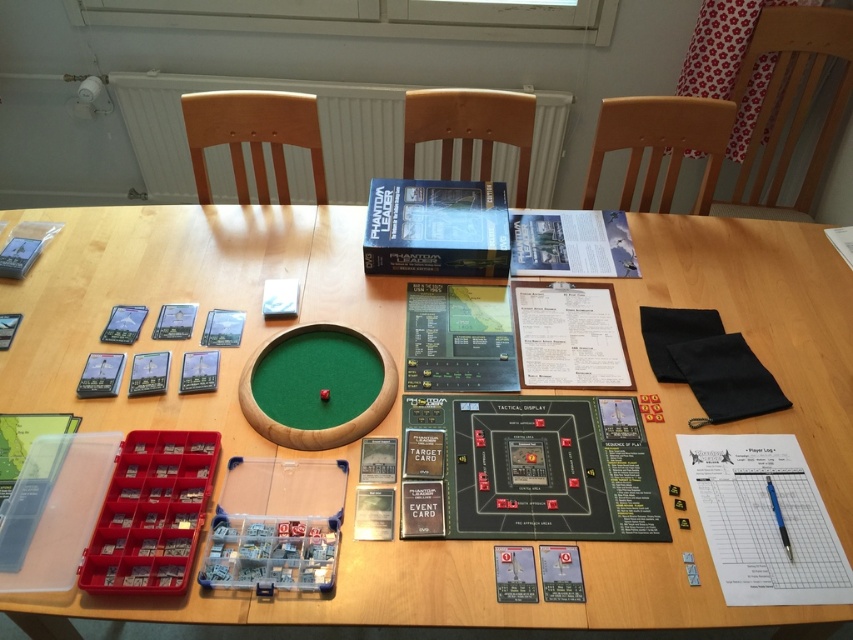
Question: Which object is farther from the camera taking this photo?

Choices:
 (A) green felt circle at center
 (B) blue plastic pen at center-right

Answer: (B)

Question: Which object appears closest to the camera in this image?

Choices:
 (A) blue plastic pen at center-right
 (B) green felt circle at center

Answer: (B)

Question: Is green felt circle at center in front of blue plastic pen at center-right?

Choices:
 (A) yes
 (B) no

Answer: (A)

Question: Can you confirm if green felt circle at center is positioned to the right of blue plastic pen at center-right?

Choices:
 (A) no
 (B) yes

Answer: (A)

Question: Is green felt circle at center bigger than blue plastic pen at center-right?

Choices:
 (A) no
 (B) yes

Answer: (B)